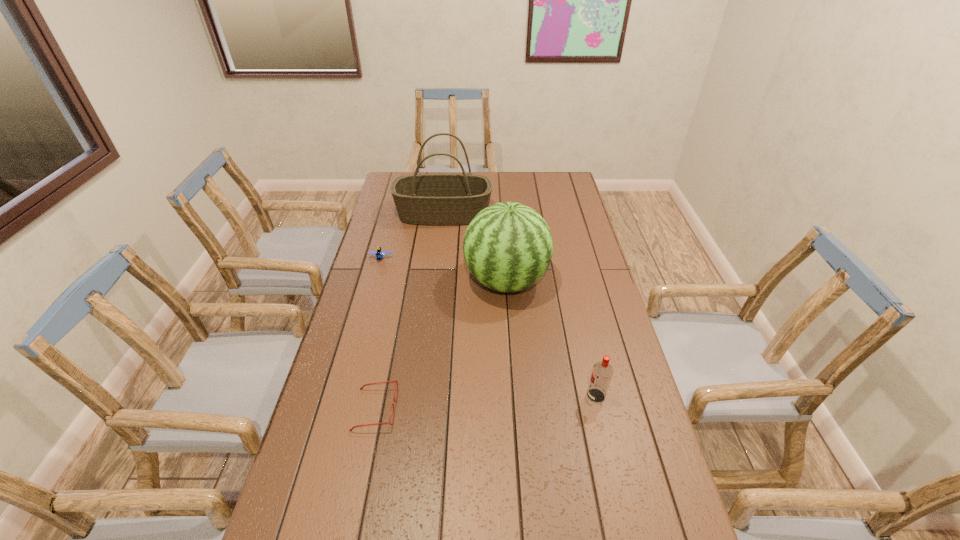
I want to click on vacant space located 0.300m on the front label of the vodka, so click(479, 396).

Identify the location of vacant space situated 0.200m on the front-facing side of the Lego. (370, 301).

What are the coordinates of `vacant point located 0.400m on the face of the spectacles` in the screenshot? It's located at (542, 409).

Find the location of `basket that is at the left edge`. basket that is at the left edge is located at coordinates (421, 199).

Find the location of a particular element. The height and width of the screenshot is (540, 960). Lego that is at the left edge is located at coordinates (379, 254).

Locate an element on the screen. Image resolution: width=960 pixels, height=540 pixels. spectacles that is at the left edge is located at coordinates (396, 380).

The height and width of the screenshot is (540, 960). Find the location of `object present at the right edge`. object present at the right edge is located at coordinates (602, 372).

In the image, there is a desktop. Identify the location of free space at the far edge. (427, 172).

Locate an element on the screen. vacant point at the left edge is located at coordinates (324, 387).

In the image, there is a desktop. Identify the location of vacant space at the right edge. point(569,279).